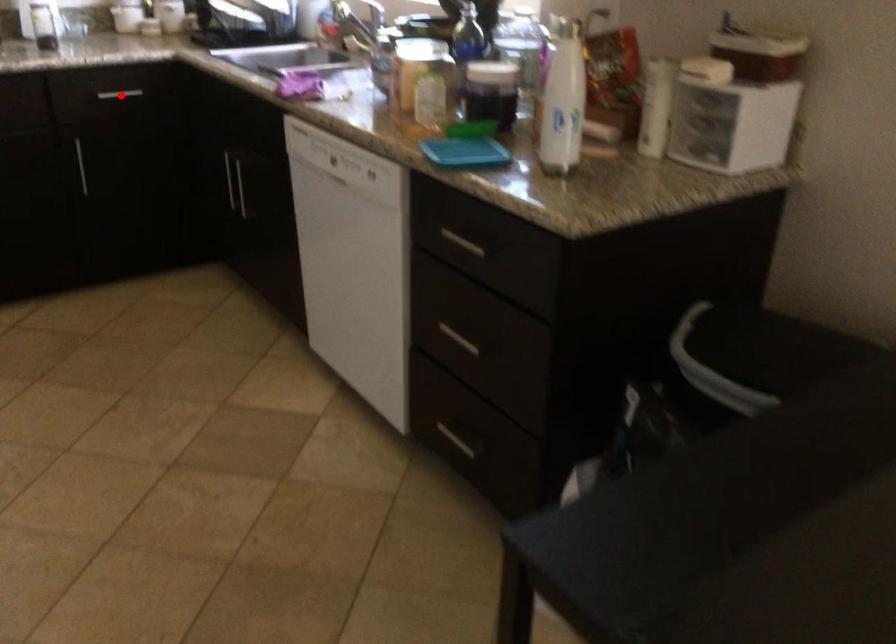
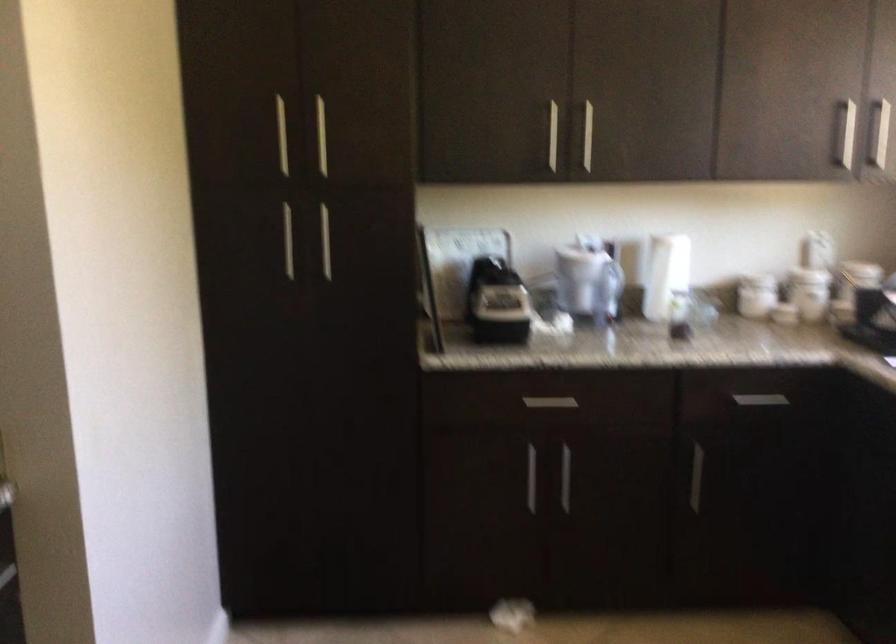
In the second image, find the point that corresponds to the highlighted location in the first image.

(760, 400)